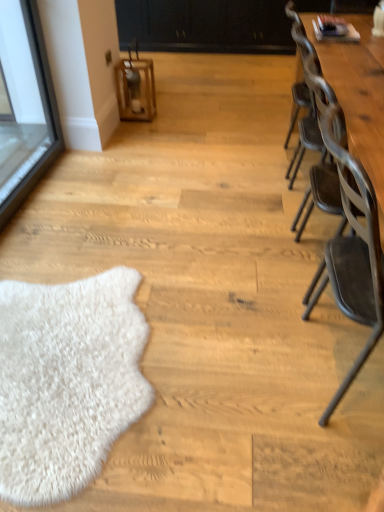
Question: Based on their sizes in the image, would you say black matte dresser at upper center is bigger or smaller than metallic gray chair at right?

Choices:
 (A) small
 (B) big

Answer: (B)

Question: Which is correct: black matte dresser at upper center is inside metallic gray chair at right, or outside of it?

Choices:
 (A) inside
 (B) outside

Answer: (B)

Question: Which is nearer to the black matte dresser at upper center?

Choices:
 (A) wooden lantern at center
 (B) metallic gray chair at right
 (C) wooden table at right

Answer: (A)

Question: Estimate the real-world distances between objects in this image. Which object is closer to the wooden lantern at center?

Choices:
 (A) metallic gray chair at right
 (B) black matte dresser at upper center
 (C) wooden table at right

Answer: (C)